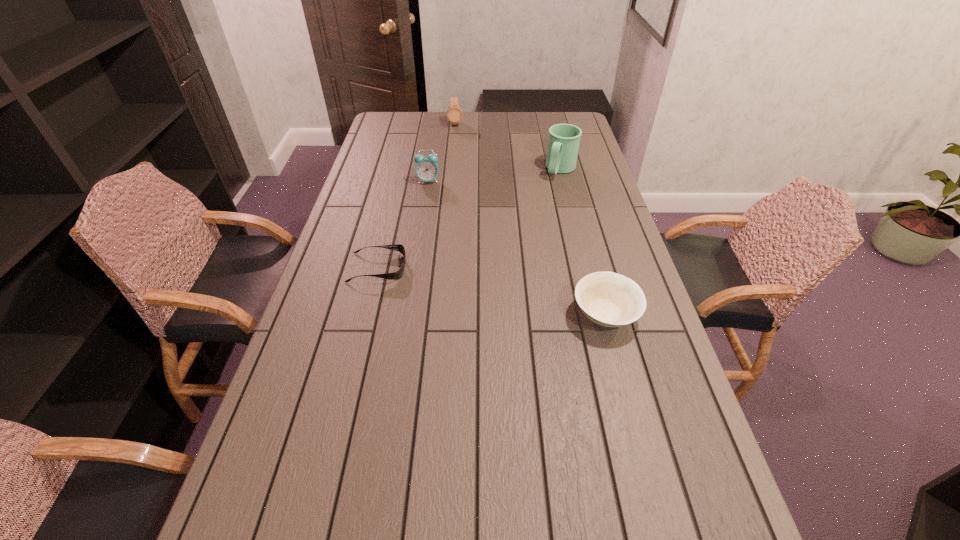
The image size is (960, 540). In order to click on free space located on the face of the third object from right to left in this screenshot , I will do (x=457, y=143).

The width and height of the screenshot is (960, 540). In order to click on free space located on the face of the third object from right to left in this screenshot , I will do `click(458, 153)`.

Identify the location of free space located 0.060m on the face of the third object from right to left. The image size is (960, 540). (456, 134).

This screenshot has height=540, width=960. Find the location of `free space located on the face of the alarm clock`. free space located on the face of the alarm clock is located at coordinates (443, 215).

The height and width of the screenshot is (540, 960). I want to click on vacant space located on the face of the alarm clock, so click(x=436, y=198).

Locate an element on the screen. This screenshot has width=960, height=540. free space located 0.320m on the face of the alarm clock is located at coordinates (451, 237).

Identify the location of vacant space located 0.170m on the side of the tallest object with the handle. Image resolution: width=960 pixels, height=540 pixels. (540, 205).

Locate an element on the screen. vacant space located 0.170m on the side of the tallest object with the handle is located at coordinates (540, 205).

This screenshot has height=540, width=960. Identify the location of free space located 0.240m on the side of the tallest object with the handle. (534, 215).

Find the location of a particular element. The width and height of the screenshot is (960, 540). object that is at the far edge is located at coordinates (454, 113).